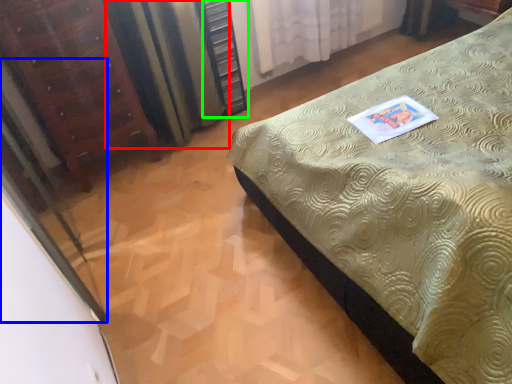
Question: Considering the real-world distances, which object is closest to curtain (highlighted by a red box)? screen door (highlighted by a blue box) or dresser (highlighted by a green box).

Choices:
 (A) screen door
 (B) dresser

Answer: (B)